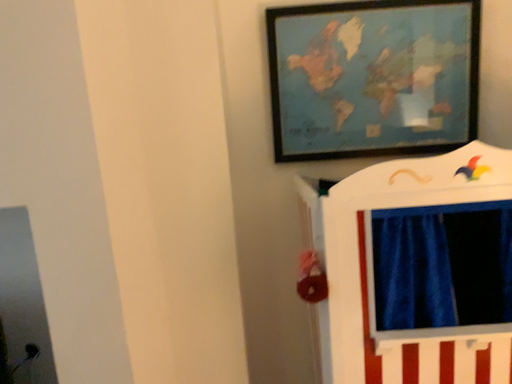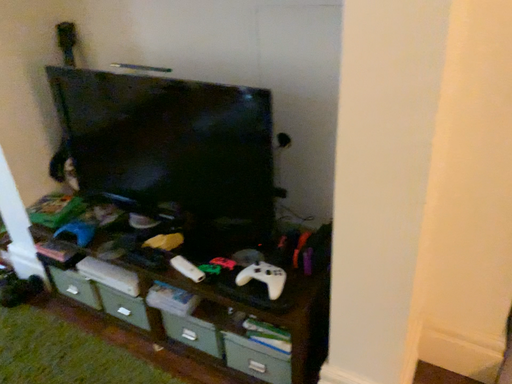
Question: How did the camera likely rotate when shooting the video?

Choices:
 (A) rotated left
 (B) rotated right

Answer: (A)